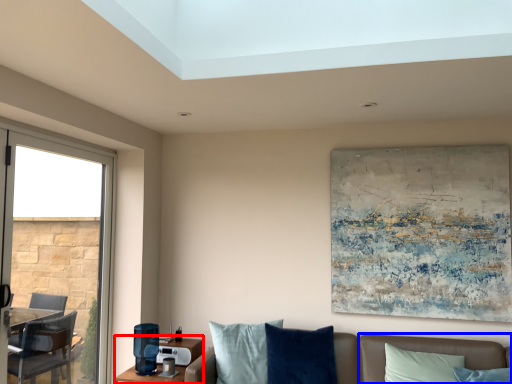
Question: Among these objects, which one is nearest to the camera, table (highlighted by a red box) or couch (highlighted by a blue box)?

Choices:
 (A) table
 (B) couch

Answer: (B)